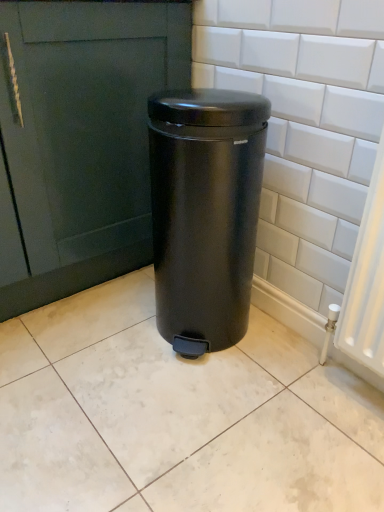
You are a GUI agent. You are given a task and a screenshot of the screen. Output one action in this format:
    pyautogui.click(x=<x>, y=<y>)
    Task: Click on the white glossy ceramic tile at center
    
    Given the screenshot: What is the action you would take?
    pyautogui.click(x=177, y=415)

Describe the element at coordinates (177, 415) in the screenshot. I see `white glossy ceramic tile at center` at that location.

Image resolution: width=384 pixels, height=512 pixels. I want to click on matte black trash can at center, so click(x=205, y=212).

Describe the element at coordinates (205, 212) in the screenshot. This screenshot has height=512, width=384. I see `matte black trash can at center` at that location.

Image resolution: width=384 pixels, height=512 pixels. Find the location of `white glossy ceramic tile at center`. white glossy ceramic tile at center is located at coordinates (177, 415).

Does white glossy ceramic tile at center appear on the left side of matte black trash can at center?

Yes, white glossy ceramic tile at center is to the left of matte black trash can at center.

Is white glossy ceramic tile at center positioned before matte black trash can at center?

Yes, it is.

Does point (35, 415) come in front of point (203, 165)?

No, it is not.

From the image's perspective, between white glossy ceramic tile at center and matte black trash can at center, which one is located above?

matte black trash can at center appears higher in the image.

From a real-world perspective, is white glossy ceramic tile at center positioned over matte black trash can at center based on gravity?

Incorrect, from a real-world perspective, white glossy ceramic tile at center is lower than matte black trash can at center.

Is white glossy ceramic tile at center wider or thinner than matte black trash can at center?

In the image, white glossy ceramic tile at center appears to be wider than matte black trash can at center.

Between white glossy ceramic tile at center and matte black trash can at center, which one has more height?

With more height is matte black trash can at center.

Based on their sizes in the image, would you say white glossy ceramic tile at center is bigger or smaller than matte black trash can at center?

Considering their sizes, white glossy ceramic tile at center takes up less space than matte black trash can at center.

Which is correct: white glossy ceramic tile at center is inside matte black trash can at center, or outside of it?

white glossy ceramic tile at center lies outside matte black trash can at center.

Is white glossy ceramic tile at center next to matte black trash can at center?

No.

Is white glossy ceramic tile at center facing away from matte black trash can at center?

No, white glossy ceramic tile at center's orientation is not away from matte black trash can at center.

How many degrees apart are the facing directions of white glossy ceramic tile at center and matte black trash can at center?

They differ by 87.9 degrees in their facing directions.

Identify the location of ceramic tile that appears below the matte black trash can at center (from the image's perspective). This screenshot has width=384, height=512. (177, 415).

Considering the positions of objects matte black trash can at center and white glossy ceramic tile at center in the image provided, who is more to the right, matte black trash can at center or white glossy ceramic tile at center?

matte black trash can at center is more to the right.

Looking at this image, considering the relative positions of matte black trash can at center and white glossy ceramic tile at center in the image provided, is matte black trash can at center in front of white glossy ceramic tile at center?

That is False.

Which is less distant, (240,326) or (317,420)?

Point (240,326).

From the image's perspective, which is above, matte black trash can at center or white glossy ceramic tile at center?

matte black trash can at center.

From a real-world perspective, is matte black trash can at center on top of white glossy ceramic tile at center?

Yes, from a real-world perspective, matte black trash can at center is on top of white glossy ceramic tile at center.

Does matte black trash can at center have a lesser width compared to white glossy ceramic tile at center?

Yes, matte black trash can at center is thinner than white glossy ceramic tile at center.

Which of these two, matte black trash can at center or white glossy ceramic tile at center, stands taller?

matte black trash can at center is taller.

Is matte black trash can at center bigger than white glossy ceramic tile at center?

Yes, matte black trash can at center is bigger than white glossy ceramic tile at center.

Is matte black trash can at center inside or outside of white glossy ceramic tile at center?

matte black trash can at center exists outside the volume of white glossy ceramic tile at center.

Is matte black trash can at center not near white glossy ceramic tile at center?

That's not correct — matte black trash can at center is a little close to white glossy ceramic tile at center.

Based on the photo, does matte black trash can at center turn towards white glossy ceramic tile at center?

Yes, matte black trash can at center is oriented towards white glossy ceramic tile at center.

Consider the image. How many degrees apart are the facing directions of matte black trash can at center and white glossy ceramic tile at center?

The angular difference between matte black trash can at center and white glossy ceramic tile at center is 87.9 degrees.

How far apart are matte black trash can at center and white glossy ceramic tile at center?

matte black trash can at center is 13.43 inches away from white glossy ceramic tile at center.

Where is `ceramic tile in front of the matte black trash can at center`? This screenshot has height=512, width=384. ceramic tile in front of the matte black trash can at center is located at coordinates (177, 415).

Find the location of a particular element. waste container above the white glossy ceramic tile at center (from a real-world perspective) is located at coordinates (205, 212).

Locate an element on the screen. The width and height of the screenshot is (384, 512). ceramic tile on the left of matte black trash can at center is located at coordinates (x=177, y=415).